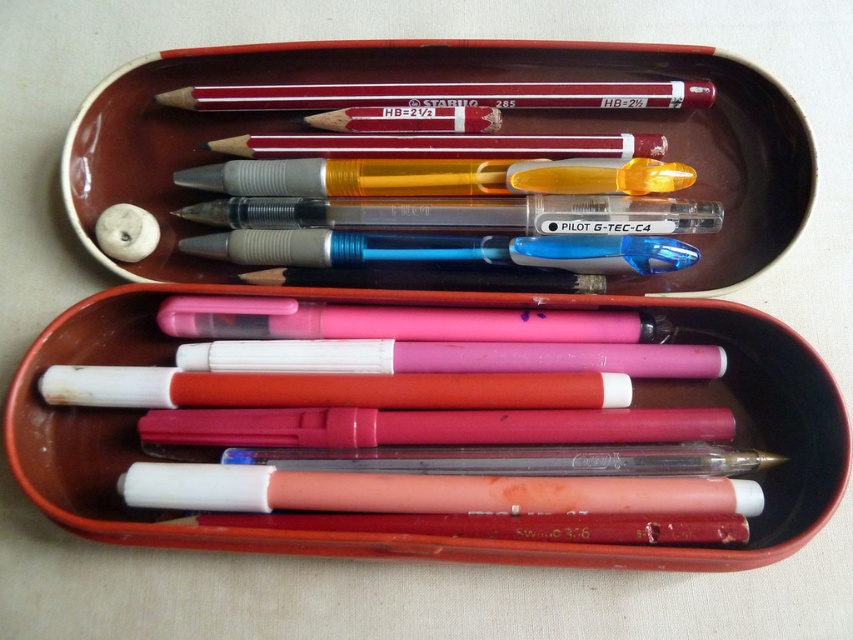
Question: Which point is farther to the camera?

Choices:
 (A) (x=120, y=227)
 (B) (x=212, y=99)

Answer: (B)

Question: Which point appears closest to the camera in this image?

Choices:
 (A) pyautogui.click(x=138, y=216)
 (B) pyautogui.click(x=285, y=104)

Answer: (A)

Question: Can you confirm if matte red pencil at upper center is positioned below white matte eraser at upper left?

Choices:
 (A) no
 (B) yes

Answer: (A)

Question: Can you confirm if matte red pencil at upper center is bigger than white matte eraser at upper left?

Choices:
 (A) no
 (B) yes

Answer: (B)

Question: Does matte red pencil at upper center have a greater width compared to white matte eraser at upper left?

Choices:
 (A) yes
 (B) no

Answer: (A)